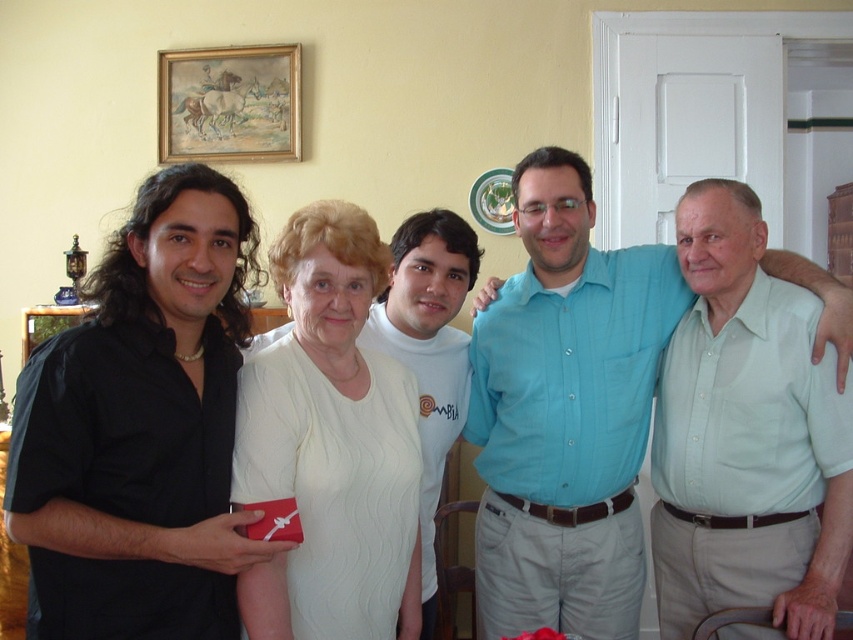
Consider the image. Is black matte shirt at left shorter than wooden picture frame at left?

Incorrect, black matte shirt at left's height does not fall short of wooden picture frame at left's.

Does black matte shirt at left appear under wooden picture frame at left?

Correct, black matte shirt at left is located below wooden picture frame at left.

Does point (30, 611) come behind point (57, 326)?

No, it is in front of (57, 326).

Find the location of a particular element. black matte shirt at left is located at coordinates (141, 428).

Is point (531, 568) less distant than point (401, 381)?

No, (531, 568) is further to viewer.

Does light blue shirt at center have a lesser width compared to white knit sweater at center?

Incorrect, light blue shirt at center's width is not less than white knit sweater at center's.

Is point (630, 518) less distant than point (346, 396)?

No.

This screenshot has height=640, width=853. I want to click on light blue shirt at center, so click(x=566, y=410).

Does light green shirt at center lie in front of white knit sweater at center?

That is False.

Image resolution: width=853 pixels, height=640 pixels. Find the location of `light green shirt at center`. light green shirt at center is located at coordinates (746, 436).

Where is `light green shirt at center`? This screenshot has width=853, height=640. light green shirt at center is located at coordinates tap(746, 436).